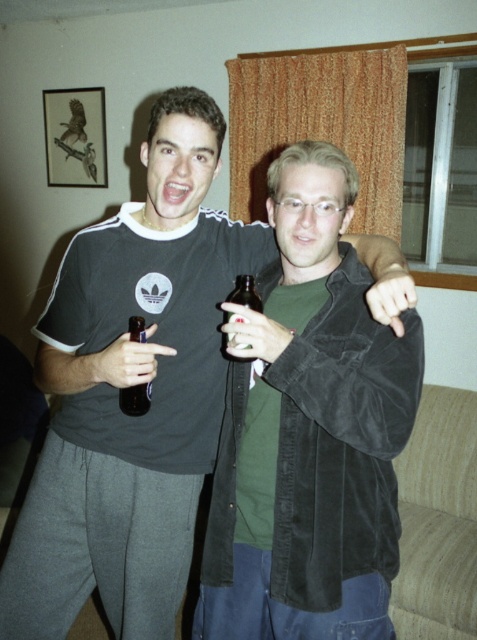
You are standing in front of the two people in the image. You want to know which of the two points, point (270,368) or point (228,320), is closer to you. Can you determine this based on their positions?

Point (270,368) is closer to the viewer than point (228,320).

You are a photographer setting up a shoot in this scene. You need to focus your camera on the velvet black jacket at center. Will the matte plastic bottle at center also be in focus if the depth of field is set to 1 meter?

The velvet black jacket at center is closer to the viewer than the matte plastic bottle at center. If the depth of field is set to 1 meter, both objects would be within the focused area since they are within 1 meter of each other. Therefore, the matte plastic bottle at center will also be in focus.